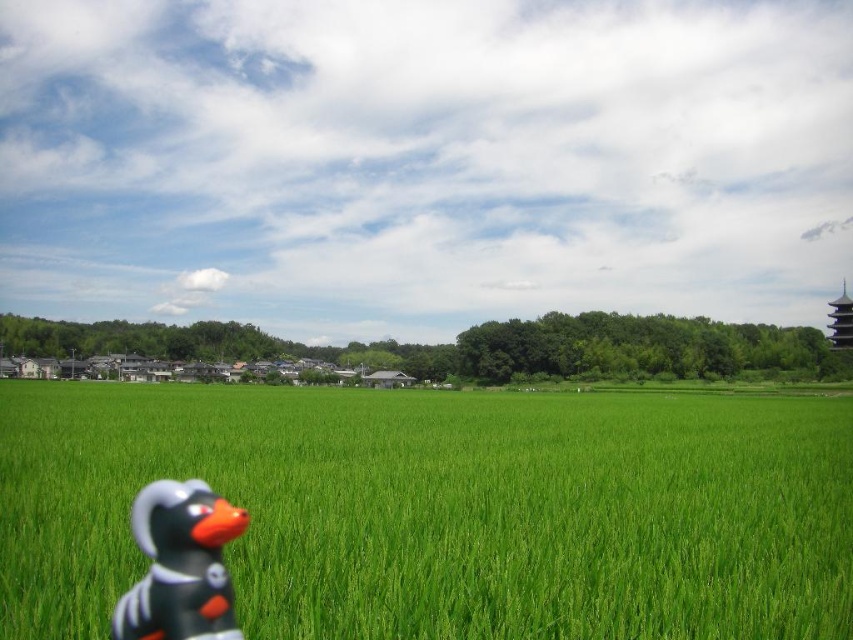
From the picture: You are a photographer trying to capture the rubber duck at lower left and the green grassy field at lower center in a single shot. Based on their sizes in the image, which object would appear larger in your photo?

The green grassy field at lower center appears larger than the rubber duck at lower left in the image.

You are standing in the middle of the rice fields and see two points marked in the scene. Which point, point (264, 627) or point (144, 518), is closer to you?

Point (144, 518) is closer to you because it is less further to the camera than point (264, 627).

You are standing in the middle of the green grassy field at lower center and want to find the rubber duck at lower left. Which direction should you move to locate it?

The rubber duck at lower left is located above the green grassy field at lower center. To find it, you should move upward from the green grassy field at lower center.